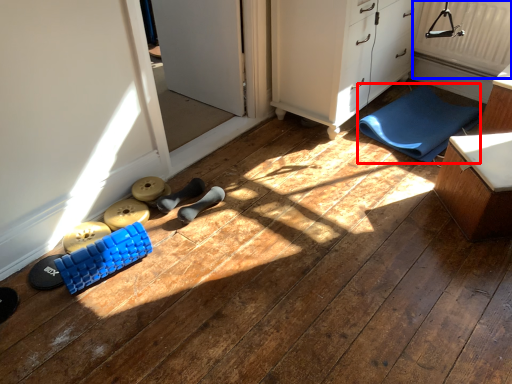
Question: Which object appears farthest to the camera in this image, yoga mat (highlighted by a red box) or radiator (highlighted by a blue box)?

Choices:
 (A) yoga mat
 (B) radiator

Answer: (B)